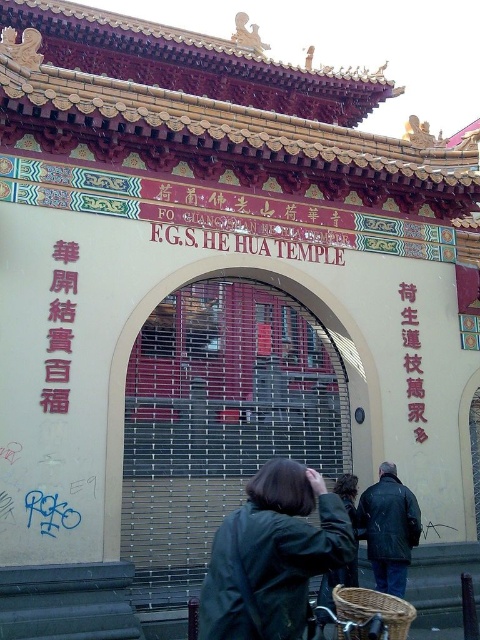
Question: Which object is positioned farthest from the dark green jacket at center?

Choices:
 (A) black matte bicycle at lower center
 (B) leather jacket at center
 (C) pink paper text at upper left

Answer: (C)

Question: Which of the following is the closest to the observer?

Choices:
 (A) (319, 497)
 (B) (63, 264)
 (C) (276, 397)

Answer: (A)

Question: Estimate the real-world distances between objects in this image. Which object is closer to the pink paper text at center right?

Choices:
 (A) black matte bicycle at lower center
 (B) dark green jacket at center
 (C) metallic gate at center

Answer: (C)

Question: Is dark green jacket at center positioned at the back of leather jacket at center?

Choices:
 (A) yes
 (B) no

Answer: (B)

Question: Is leather jacket at center below black matte bicycle at lower center?

Choices:
 (A) no
 (B) yes

Answer: (A)

Question: Does metallic gate at center come behind black matte bicycle at lower center?

Choices:
 (A) no
 (B) yes

Answer: (B)